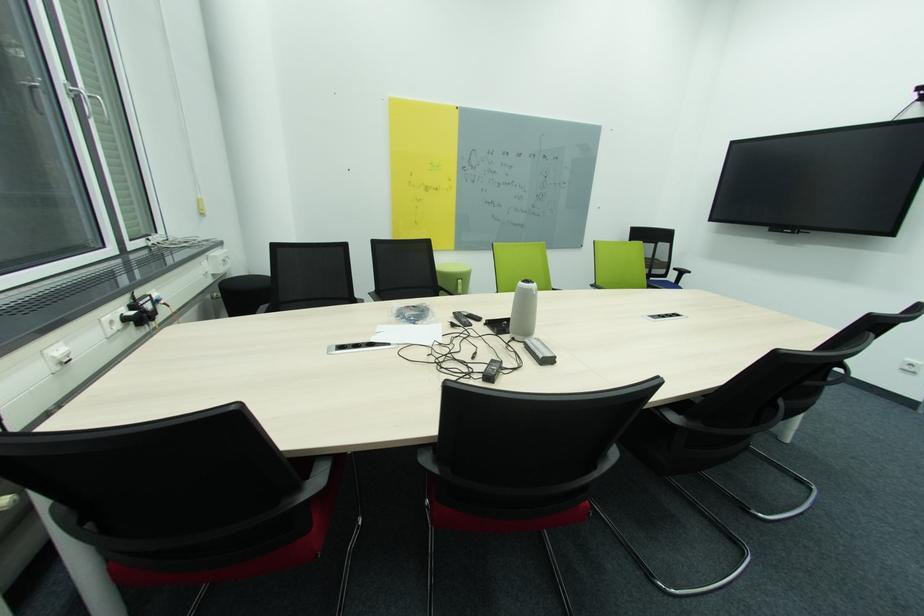
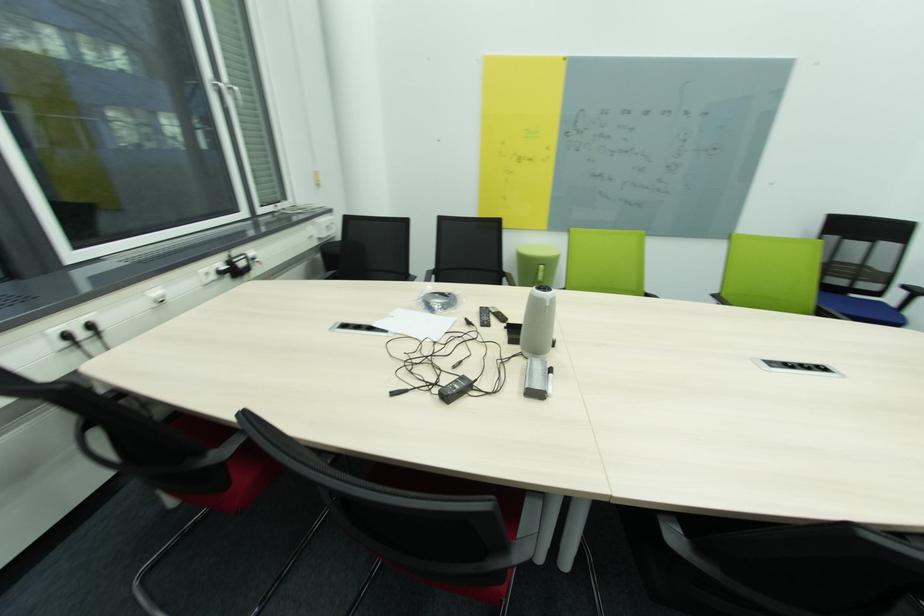
Question: How did the camera likely rotate?

Choices:
 (A) Left
 (B) Right
 (C) Up
 (D) Down

Answer: (A)